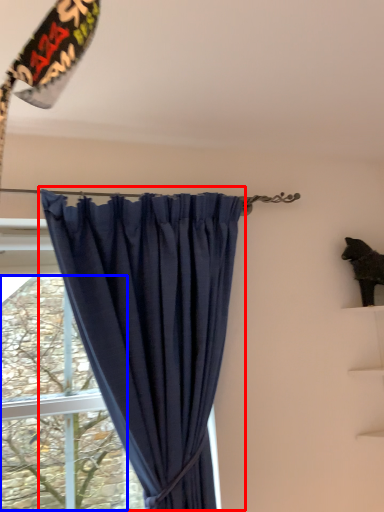
Question: Which object appears farthest to the camera in this image, curtain (highlighted by a red box) or tree (highlighted by a blue box)?

Choices:
 (A) curtain
 (B) tree

Answer: (B)